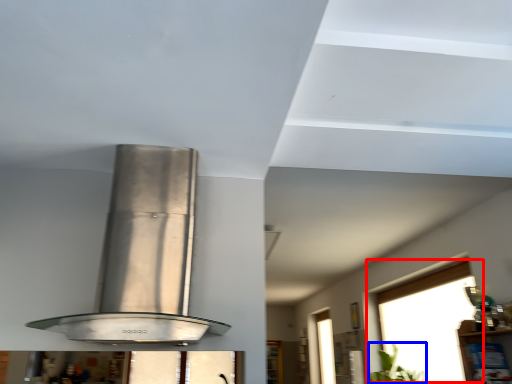
Question: Which object is closer to the camera taking this photo, window (highlighted by a red box) or plant (highlighted by a blue box)?

Choices:
 (A) window
 (B) plant

Answer: (A)